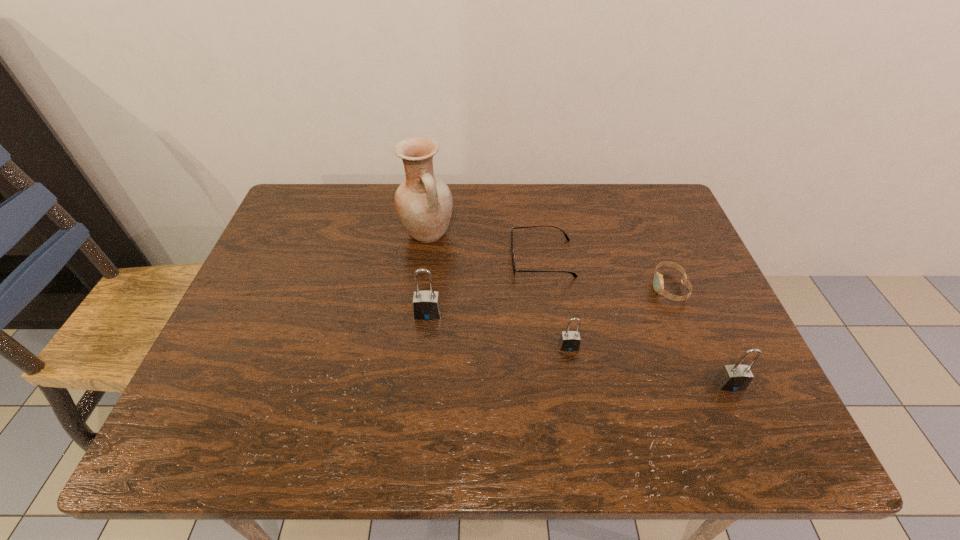
You are a GUI agent. You are given a task and a screenshot of the screen. Output one action in this format:
    pyautogui.click(x=<x>, y=<y>)
    Task: Click on the free spot between the spectacles and the second tallest padlock
    
    Given the screenshot: What is the action you would take?
    pyautogui.click(x=636, y=321)

Find the location of a particular element. Image resolution: width=960 pixels, height=540 pixels. vacant area between the farthest padlock and the fifth tallest object is located at coordinates (548, 300).

I want to click on free area in between the spectacles and the second nearest object, so click(555, 302).

The width and height of the screenshot is (960, 540). In order to click on blank region between the shortest object and the tallest object in this screenshot , I will do `click(485, 246)`.

This screenshot has height=540, width=960. What are the coordinates of `vacant area that lies between the third tallest object and the second padlock from left to right` in the screenshot? It's located at (649, 365).

Identify the location of free point between the leftmost padlock and the spectacles. Image resolution: width=960 pixels, height=540 pixels. (485, 286).

Find the location of a particular element. This screenshot has width=960, height=540. empty space that is in between the spectacles and the fourth shortest object is located at coordinates (636, 321).

Locate an element on the screen. free spot between the second shortest padlock and the spectacles is located at coordinates (636, 321).

At what (x,y) coordinates should I click in order to perform the action: click on free spot between the shortest object and the pottery. Please return your answer as a coordinate pair (x, y). Looking at the image, I should click on (485, 246).

Choose which object is the nearest neighbor to the fifth tallest object. Please provide its 2D coordinates. Your answer should be formatted as a tuple, i.e. [(x, y)], where the tuple contains the x and y coordinates of a point satisfying the conditions above.

[(566, 236)]